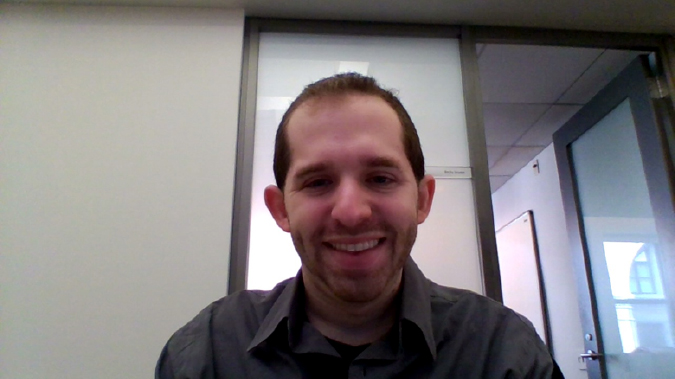
Identify the location of alarm light. (534, 165).